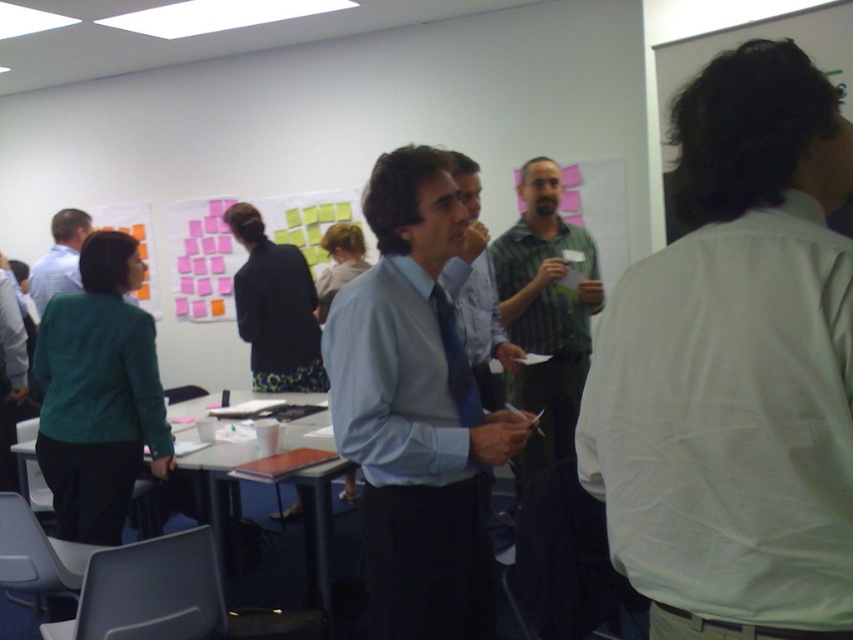
You are a person standing at point (x=416, y=412) in the meeting room. What are you wearing?

The light blue shirt at center is located at point (x=416, y=412), so you are wearing a light blue shirt at center.

From the picture: You are standing in the meeting room and need to locate the green striped shirt at center. According to the coordinates provided, where exactly should you look?

The green striped shirt at center is located at the coordinates point (544,312).